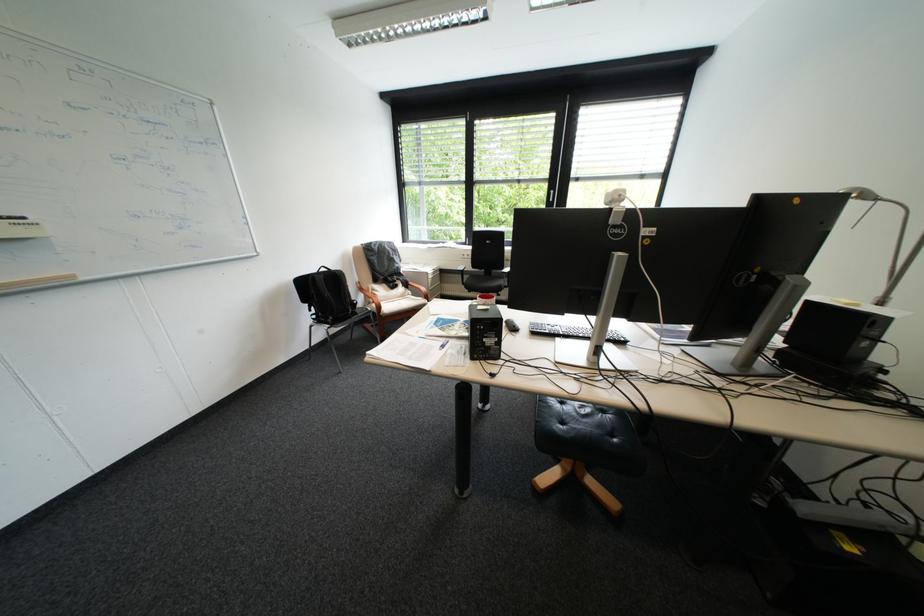
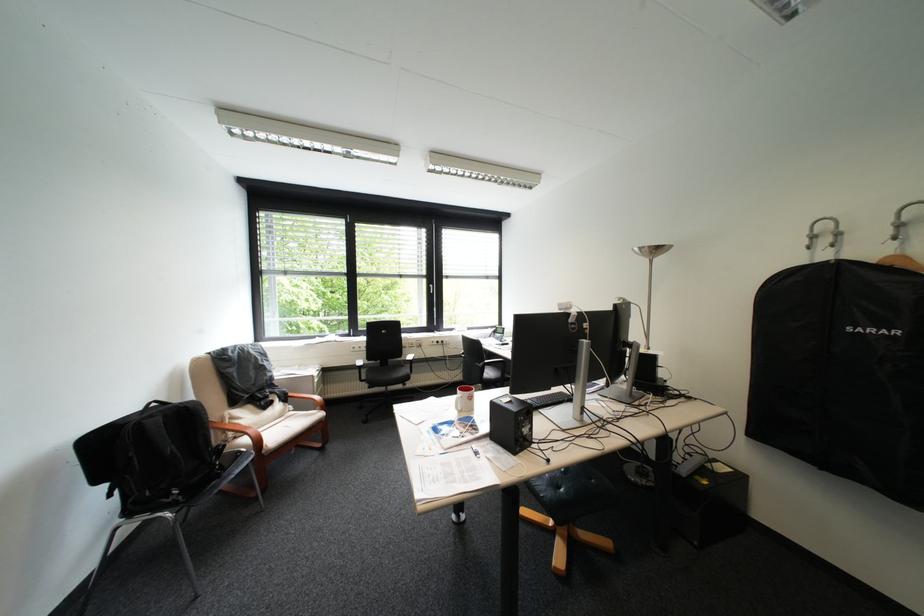
Find the pixel in the second image that matches pixel 450 337 in the first image.

(469, 446)